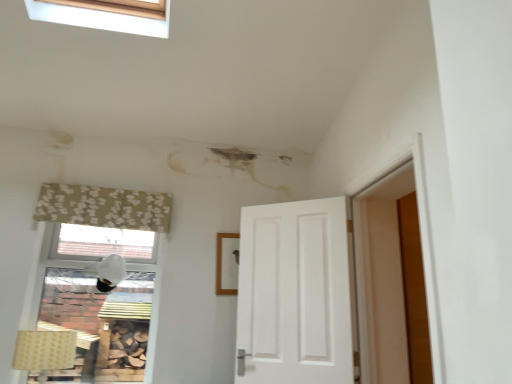
Question: Can you confirm if beige floral fabric curtain at upper left is positioned to the left of yellow fabric lampshade at lower left, which is counted as the 1th lamp, starting from the front?

Choices:
 (A) yes
 (B) no

Answer: (B)

Question: Considering the relative sizes of beige floral fabric curtain at upper left and yellow fabric lampshade at lower left, which ranks as the 2th lamp in top-to-bottom order, in the image provided, is beige floral fabric curtain at upper left smaller than yellow fabric lampshade at lower left, which ranks as the 2th lamp in top-to-bottom order,?

Choices:
 (A) no
 (B) yes

Answer: (B)

Question: Can you confirm if beige floral fabric curtain at upper left is shorter than yellow fabric lampshade at lower left, marked as the 2th lamp in a right-to-left arrangement?

Choices:
 (A) no
 (B) yes

Answer: (B)

Question: Is beige floral fabric curtain at upper left to the right of yellow fabric lampshade at lower left, which is the 1th lamp in bottom-to-top order, from the viewer's perspective?

Choices:
 (A) no
 (B) yes

Answer: (B)

Question: Is beige floral fabric curtain at upper left positioned with its back to yellow fabric lampshade at lower left, which ranks as the 2th lamp in top-to-bottom order?

Choices:
 (A) yes
 (B) no

Answer: (B)

Question: Is beige floral fabric curtain at upper left positioned far away from yellow fabric lampshade at lower left, which is the 1th lamp in bottom-to-top order?

Choices:
 (A) yes
 (B) no

Answer: (B)

Question: Is yellow fabric lampshade at lower left, which ranks as the 2th lamp in top-to-bottom order, further to the viewer compared to beige floral fabric curtain at upper left?

Choices:
 (A) no
 (B) yes

Answer: (A)

Question: Does yellow fabric lampshade at lower left, which ranks as the 2th lamp in top-to-bottom order, have a larger size compared to beige floral fabric curtain at upper left?

Choices:
 (A) no
 (B) yes

Answer: (B)

Question: Would you consider yellow fabric lampshade at lower left, which is the 1th lamp in bottom-to-top order, to be distant from beige floral fabric curtain at upper left?

Choices:
 (A) yes
 (B) no

Answer: (B)

Question: Is yellow fabric lampshade at lower left, which is counted as the first lamp, starting from the left, positioned beyond the bounds of beige floral fabric curtain at upper left?

Choices:
 (A) no
 (B) yes

Answer: (B)

Question: From the image's perspective, is yellow fabric lampshade at lower left, which is counted as the 1th lamp, starting from the front, over beige floral fabric curtain at upper left?

Choices:
 (A) no
 (B) yes

Answer: (A)

Question: Is beige floral fabric curtain at upper left inside yellow fabric lampshade at lower left, which is counted as the 1th lamp, starting from the front?

Choices:
 (A) no
 (B) yes

Answer: (A)

Question: From the image's perspective, would you say beige floral fabric curtain at upper left is shown under white matte lampshade at upper left, which is the second lamp from front to back?

Choices:
 (A) no
 (B) yes

Answer: (A)